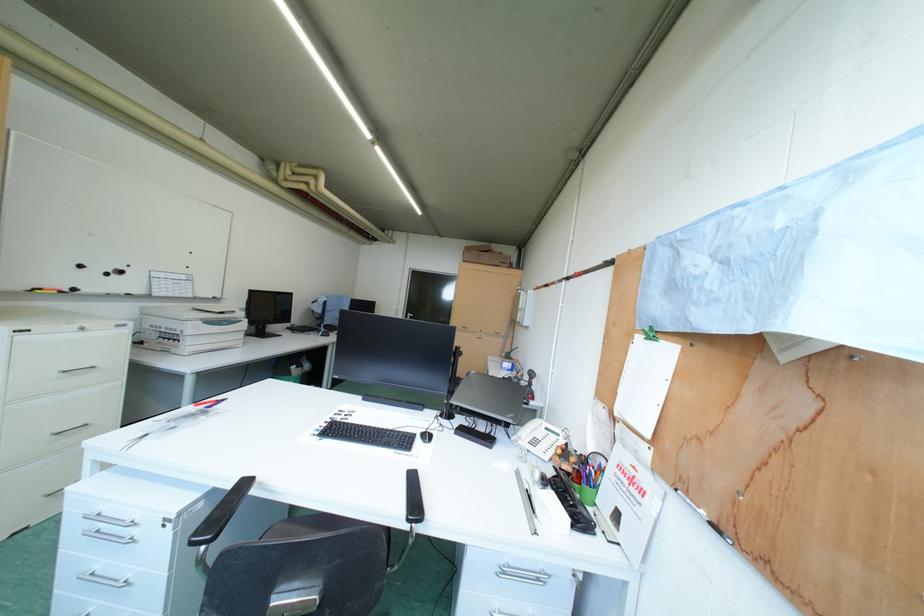
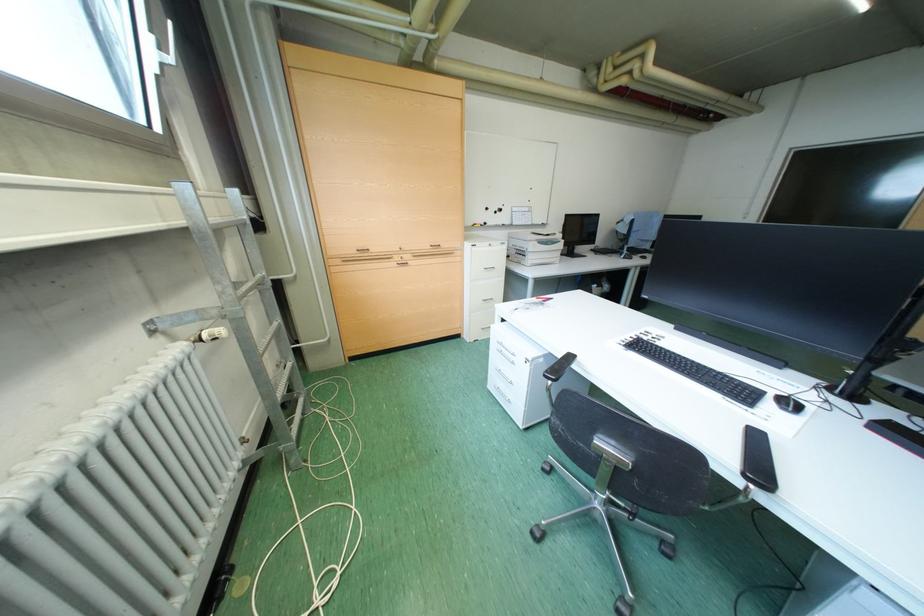
How did the camera likely rotate?

The rotation direction of the camera is left-down.